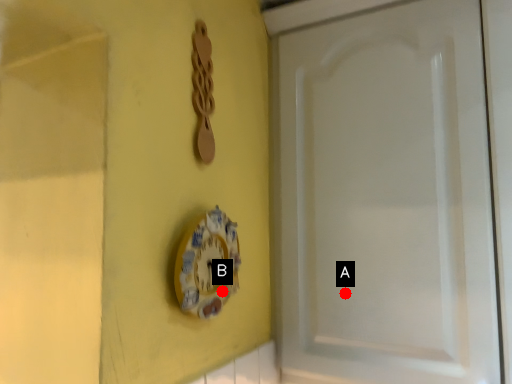
Question: Two points are circled on the image, labeled by A and B beside each circle. Which point is further to the camera?

Choices:
 (A) A is further
 (B) B is further

Answer: (A)